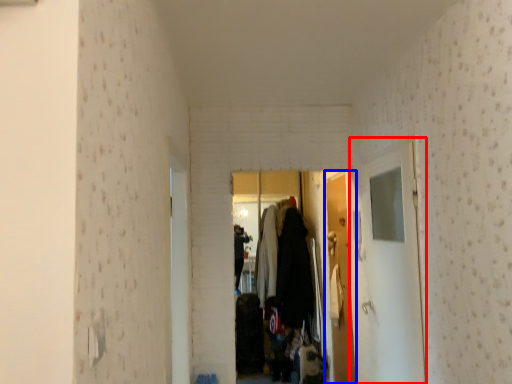
Question: Which object appears closest to the camera in this image, glass door (highlighted by a red box) or door (highlighted by a blue box)?

Choices:
 (A) glass door
 (B) door

Answer: (A)